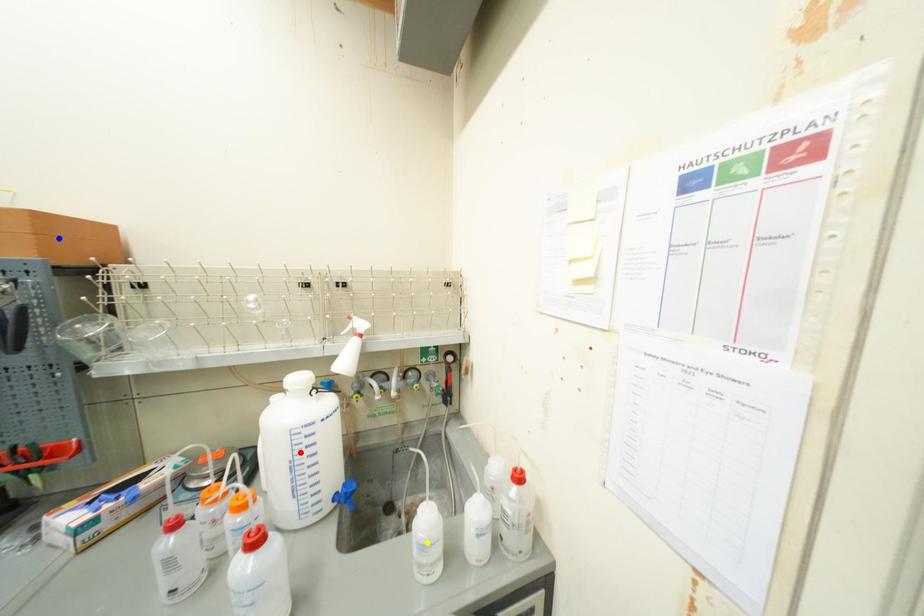
Order these from nearest to farthest:
A) yellow point
B) red point
C) blue point

blue point, red point, yellow point